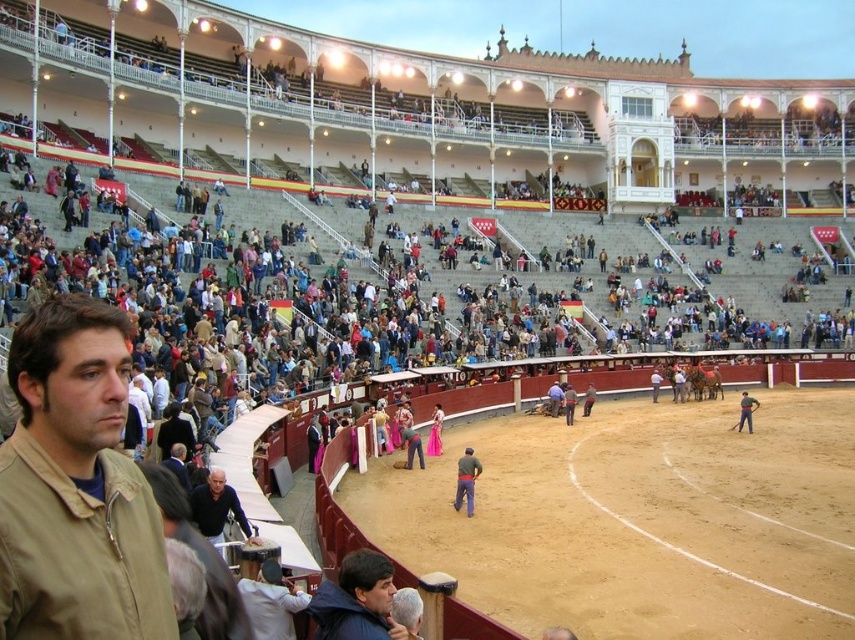
You are a photographer standing at the edge of the arena, and you need to capture a photo of both the dark blue jeans at center and the smooth leather jacket at center. Since you want to ensure both are visible in the frame, which object should you focus on first to account for their sizes?

The dark blue jeans at center has a greater height compared to the smooth leather jacket at center, so you should focus on the dark blue jeans at center first to ensure it fits within the frame before adjusting for the smaller jacket.

You are standing at the edge of the bullfighting arena and want to reach the dark blue jeans at center and the smooth leather jacket at center. Which item is closer to you?

Both the dark blue jeans at center and the smooth leather jacket at center are at the same central position in the arena, so they are equally distant from you.